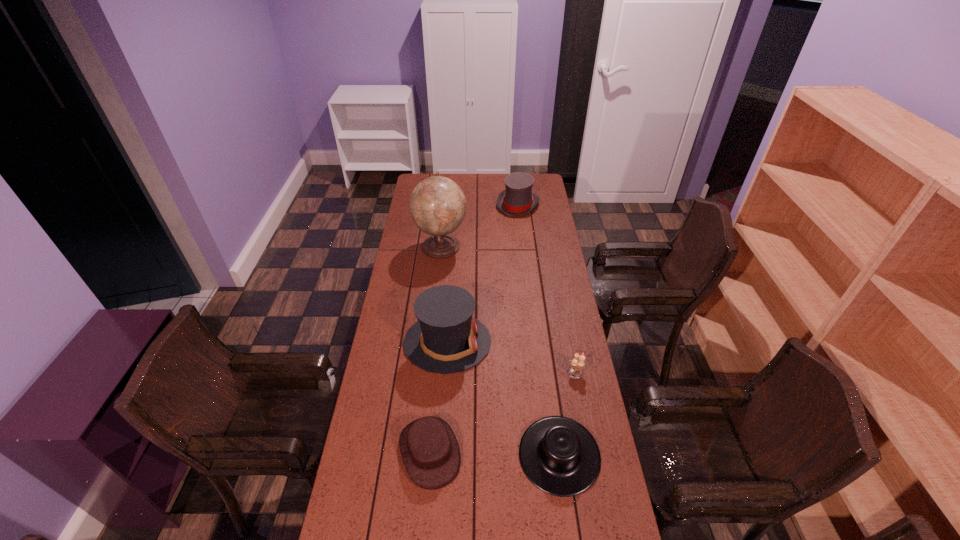
Locate an element on the screen. This screenshot has height=540, width=960. object that is the fourth closest to the third nearest hat is located at coordinates (437, 204).

Point out which hat is positioned as the fourth nearest to the globe. Please provide its 2D coordinates. Your answer should be formatted as a tuple, i.e. [(x, y)], where the tuple contains the x and y coordinates of a point satisfying the conditions above.

[(559, 456)]

The height and width of the screenshot is (540, 960). Find the location of `hat that is the third closest to the second tallest hat`. hat that is the third closest to the second tallest hat is located at coordinates (430, 451).

Identify the location of free spot that satisfies the following two spatial constraints: 1. on the front-facing side of the fifth nearest object; 2. on the back side of the candle holder. (428, 372).

Identify the location of vacant space that satisfies the following two spatial constraints: 1. on the front side of the candle holder; 2. on the left side of the farthest hat. (537, 372).

The width and height of the screenshot is (960, 540). What are the coordinates of `vacant space that satisfies the following two spatial constraints: 1. on the front-facing side of the globe; 2. on the left side of the candle holder` in the screenshot? It's located at (428, 372).